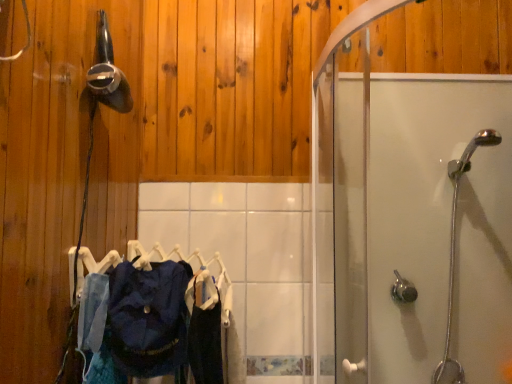
Question: Would you consider satin nickel shower handle at lower right, which is the first shower in bottom-to-top order, to be distant from metallic silver hairdryer at upper left, the third shower ordered from the bottom?

Choices:
 (A) yes
 (B) no

Answer: (A)

Question: Is satin nickel shower handle at lower right, the third shower positioned from the top, positioned with its back to metallic silver hairdryer at upper left, which is counted as the 1th shower, starting from the top?

Choices:
 (A) yes
 (B) no

Answer: (B)

Question: Does satin nickel shower handle at lower right, the second shower when ordered from left to right, appear on the right side of metallic silver hairdryer at upper left, the third shower ordered from the bottom?

Choices:
 (A) yes
 (B) no

Answer: (A)

Question: From a real-world perspective, does satin nickel shower handle at lower right, which is the 2th shower from right to left, sit lower than metallic silver hairdryer at upper left, the third shower ordered from the bottom?

Choices:
 (A) no
 (B) yes

Answer: (B)

Question: Is satin nickel shower handle at lower right, the second shower when ordered from left to right, thinner than metallic silver hairdryer at upper left, the 1th shower positioned from the left?

Choices:
 (A) no
 (B) yes

Answer: (B)

Question: Does satin nickel shower handle at lower right, which is the 2th shower from right to left, have a greater width compared to metallic silver hairdryer at upper left, the 1th shower positioned from the left?

Choices:
 (A) yes
 (B) no

Answer: (B)

Question: Does dark blue fabric at center, acting as the 1th clothing starting from the right, lie behind dark blue fabric at center, which is counted as the second clothing, starting from the right?

Choices:
 (A) yes
 (B) no

Answer: (A)

Question: From a real-world perspective, does dark blue fabric at center, acting as the 1th clothing starting from the right, stand above dark blue fabric at center, which is counted as the second clothing, starting from the right?

Choices:
 (A) no
 (B) yes

Answer: (A)

Question: Does dark blue fabric at center, the second clothing when ordered from left to right, have a larger size compared to dark blue fabric at center, which is counted as the second clothing, starting from the right?

Choices:
 (A) no
 (B) yes

Answer: (A)

Question: Is there a large distance between dark blue fabric at center, the second clothing when ordered from left to right, and dark blue fabric at center, which is counted as the second clothing, starting from the right?

Choices:
 (A) no
 (B) yes

Answer: (A)

Question: Can you confirm if dark blue fabric at center, acting as the 1th clothing starting from the right, is shorter than dark blue fabric at center, the first clothing in the left-to-right sequence?

Choices:
 (A) yes
 (B) no

Answer: (B)

Question: Is dark blue fabric at center, acting as the 1th clothing starting from the right, facing away from dark blue fabric at center, which is counted as the second clothing, starting from the right?

Choices:
 (A) no
 (B) yes

Answer: (A)

Question: Can you confirm if chrome metallic showerhead at right, which is counted as the first shower, starting from the right, is shorter than metallic silver hairdryer at upper left, the third shower ordered from the bottom?

Choices:
 (A) yes
 (B) no

Answer: (B)